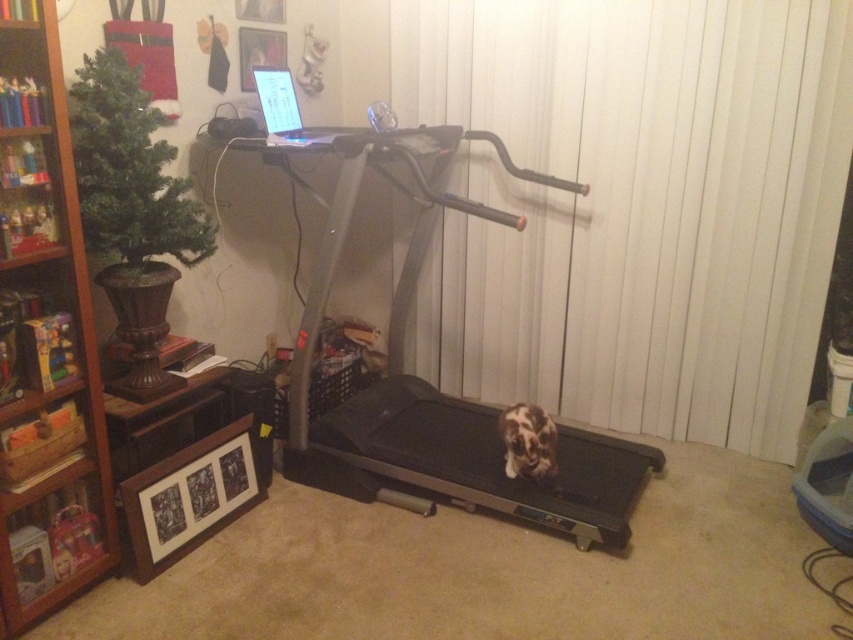
Question: Among these objects, which one is nearest to the camera?

Choices:
 (A) silver metallic treadmill at center
 (B) wooden bookshelf at left

Answer: (B)

Question: Can you confirm if wooden bookshelf at left is thinner than silver metallic treadmill at center?

Choices:
 (A) no
 (B) yes

Answer: (B)

Question: Which point appears closest to the camera in this image?

Choices:
 (A) (67, 170)
 (B) (488, 461)

Answer: (A)

Question: Does wooden bookshelf at left appear on the left side of silver metallic treadmill at center?

Choices:
 (A) no
 (B) yes

Answer: (B)

Question: Is wooden bookshelf at left smaller than silver metallic treadmill at center?

Choices:
 (A) yes
 (B) no

Answer: (A)